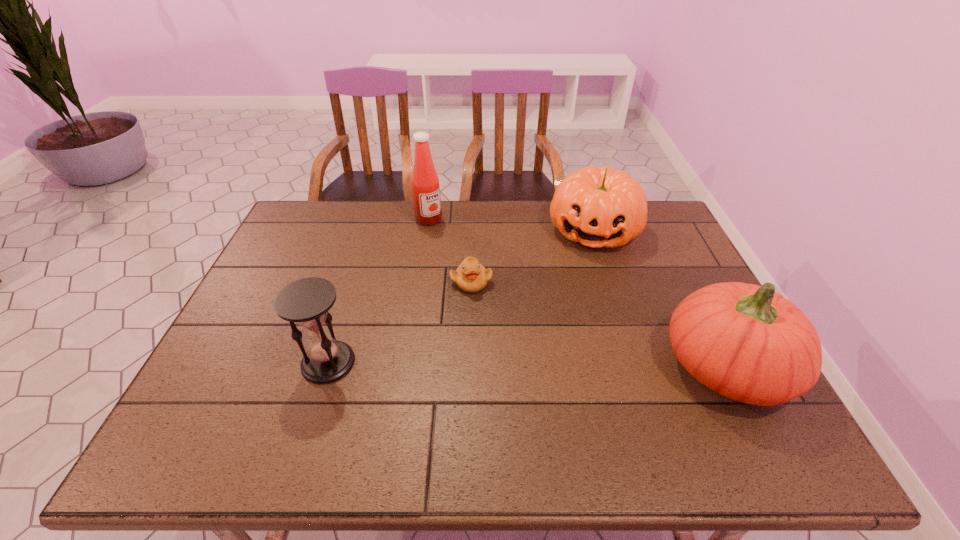
The image size is (960, 540). Identify the location of hourglass at the near edge. (306, 301).

The height and width of the screenshot is (540, 960). I want to click on pumpkin located in the near edge section of the desktop, so click(x=748, y=343).

This screenshot has height=540, width=960. Find the location of `object located at the far right corner`. object located at the far right corner is located at coordinates (598, 207).

What are the coordinates of `object present at the near right corner` in the screenshot? It's located at (748, 343).

Image resolution: width=960 pixels, height=540 pixels. In the image, there is a desktop. In order to click on free space at the far edge in this screenshot , I will do pyautogui.click(x=411, y=200).

In the image, there is a desktop. Where is `vacant space at the near edge`? vacant space at the near edge is located at coordinates (356, 394).

The width and height of the screenshot is (960, 540). Identify the location of free space at the left edge of the desktop. (290, 256).

Image resolution: width=960 pixels, height=540 pixels. In order to click on blank space at the right edge of the desktop in this screenshot , I will do (x=674, y=253).

In the image, there is a desktop. Where is `vacant space at the near left corner`? Image resolution: width=960 pixels, height=540 pixels. vacant space at the near left corner is located at coordinates (233, 382).

Where is `vacant space at the far right corner of the desktop`? This screenshot has height=540, width=960. vacant space at the far right corner of the desktop is located at coordinates (662, 230).